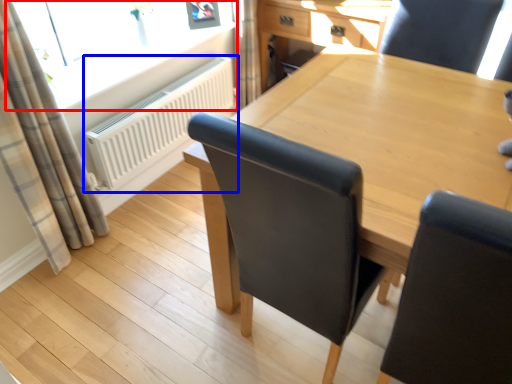
Question: Which object appears closest to the camera in this image, window (highlighted by a red box) or radiator (highlighted by a blue box)?

Choices:
 (A) window
 (B) radiator

Answer: (A)